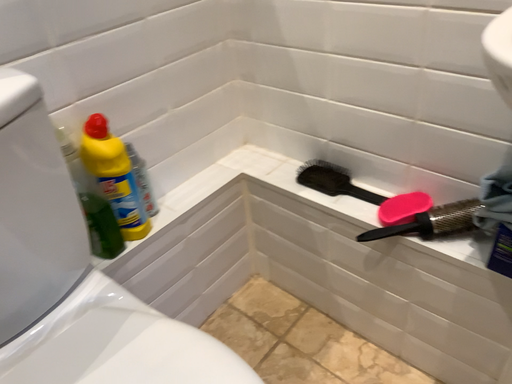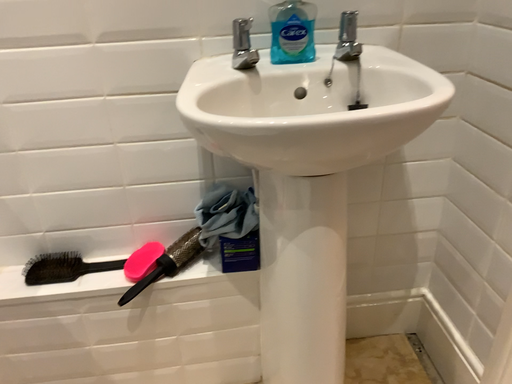
Question: How did the camera likely rotate when shooting the video?

Choices:
 (A) rotated right
 (B) rotated left

Answer: (A)